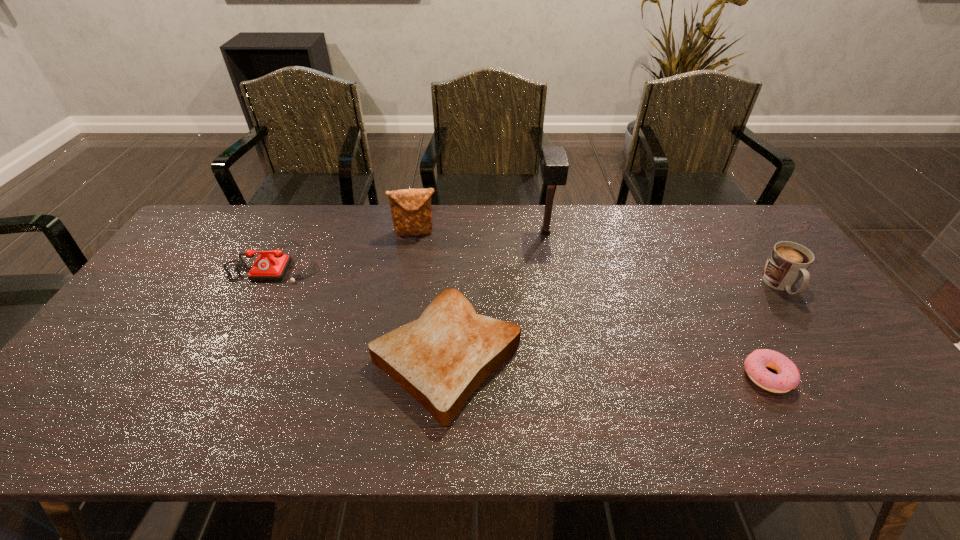
I want to click on object that is at the right edge, so click(x=788, y=261).

Locate an element on the screen. This screenshot has width=960, height=540. free region at the far edge is located at coordinates (584, 213).

Identify the location of free region at the near edge of the desktop. The height and width of the screenshot is (540, 960). (420, 415).

Where is `vacant region at the left edge`? The width and height of the screenshot is (960, 540). vacant region at the left edge is located at coordinates (148, 364).

Where is `free space at the far left corner of the desktop`? Image resolution: width=960 pixels, height=540 pixels. free space at the far left corner of the desktop is located at coordinates (205, 245).

Identify the location of empty location between the third shortest object and the fifth object from left to right. (521, 319).

Where is `free space between the fifth tallest object and the rightmost object`? The width and height of the screenshot is (960, 540). free space between the fifth tallest object and the rightmost object is located at coordinates (613, 321).

I want to click on empty location between the tallest object and the doughnut, so click(x=657, y=305).

You are a GUI agent. You are given a task and a screenshot of the screen. Output one action in this format:
    pyautogui.click(x=<x>, y=<y>)
    Task: Click on the free space between the leftmost object and the doughnut
    The width and height of the screenshot is (960, 540).
    Given the screenshot: What is the action you would take?
    pyautogui.click(x=521, y=319)

This screenshot has height=540, width=960. Identify the location of vacant space that is in between the mallet and the shortest object. (657, 305).